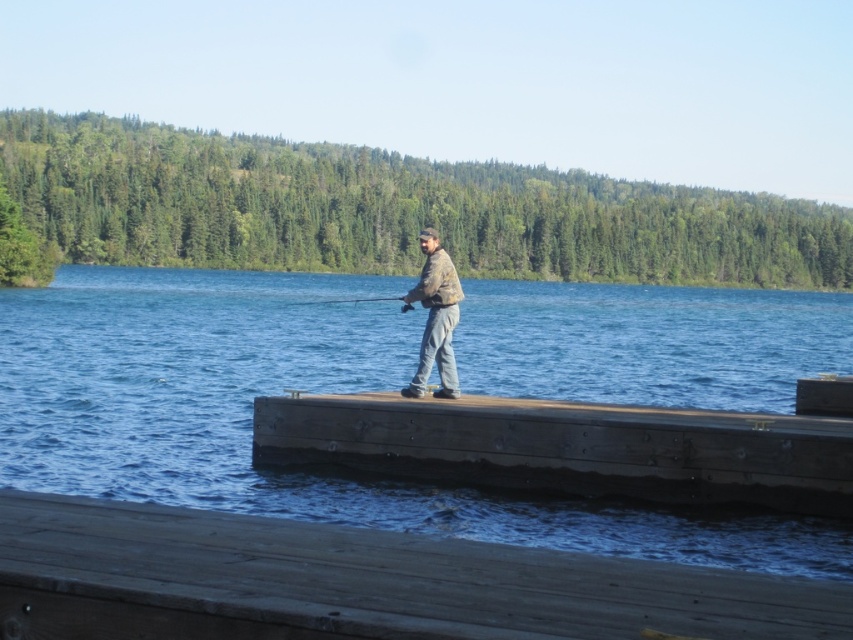
You are a photographer standing at the lakeside. You want to capture a photo where the brown wood dock at center and the smooth wooden fishing pole at center are both visible. Which object will appear smaller in the photo?

The brown wood dock at center will appear smaller in the photo because it has a smaller size compared to the smooth wooden fishing pole at center.

You are a photographer trying to capture the brown wooden dock at center and the smooth wooden fishing pole at center in a single shot. Based on their sizes, which object should you focus on to ensure both are clearly visible in the frame?

The brown wooden dock at center is smaller than the smooth wooden fishing pole at center, so focusing on the smaller dock will allow the larger fishing pole to also be clearly visible in the frame.